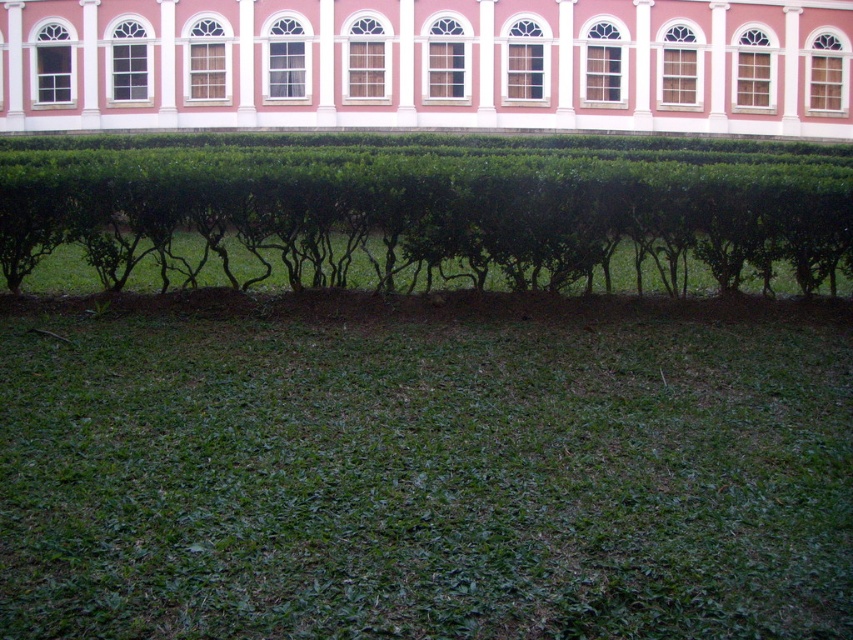
You are standing in the garden and want to walk from the lawn to the building. Which direction should you go past the green leafy bush at center and the pink smooth wall at upper center?

You should go to the right of the green leafy bush at center since it is to the left of the pink smooth wall at upper center, meaning the building is beyond the wall to the right.

You are standing in the garden and want to place a small statue exactly halfway between point (96,604) and point (109,214). Will the statue be closer to the camera or farther away compared to the shrubs in the midground?

The statue placed halfway between point (96,604) and point (109,214) will be closer to the camera than the midground shrubs because point (96,604) is closer to the camera than point (109,214). Since the statue is halfway between them, its position averages their distances, but since one is closer, the average would still be closer than the farther point. However, the shrubs are in the midground, which is farther than the closer point, so the statue would be closer than the shrubs.

You are a gardener who needs to place a 10 meter long fence between the green leafy bush at center and the pink smooth wall at upper center. Based on the scene, can the fence fit in the space between them?

The distance between the green leafy bush at center and the pink smooth wall at upper center is 9.48 meters. Since the fence is 10 meters long, it will not fit in the available space as the distance is shorter than the fence length.